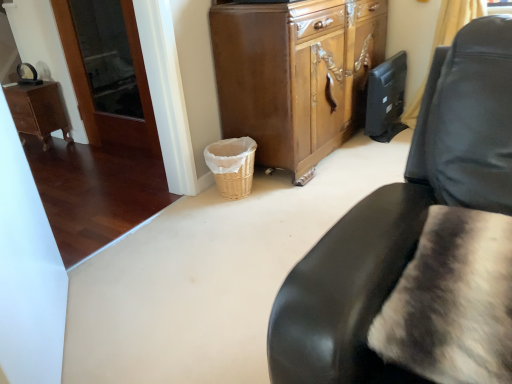
Identify the location of vacant space underneath woven wicker basket at lower center (from a real-world perspective). Image resolution: width=512 pixels, height=384 pixels. (241, 192).